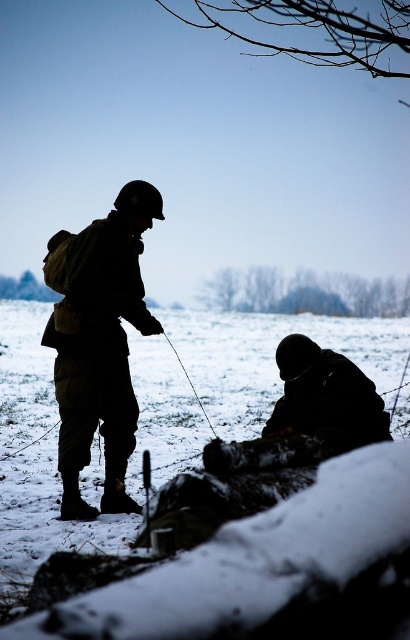
You are planning to build a snowman using the white powdery snow at lower center. Considering the height of the black matte uniform at center, do you think there is enough snow available to make a snowman taller than the uniform?

The white powdery snow at lower center has a lesser height compared to the black matte uniform at center. Therefore, there is not enough snow to make a snowman taller than the uniform.

You are navigating a winter landscape and need to locate the black matte uniform at center. According to the coordinates provided, where would you find it?

The black matte uniform at center is located at coordinates point (100, 346).

You are a hiker trying to determine where to step next. You see the white powdery snow at lower center and the black matte uniform at center. Which object is closer to the ground?

The white powdery snow at lower center is closer to the ground since it is below the black matte uniform at center.